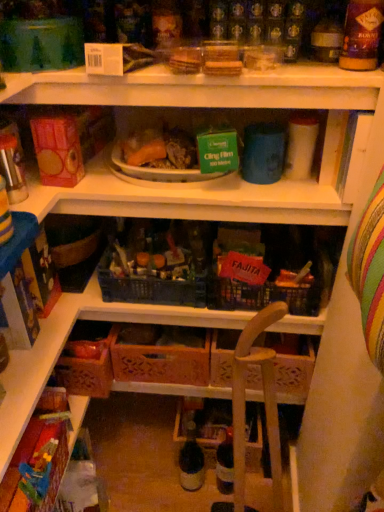
Question: Based on their sizes in the image, would you say wooden crate at center is bigger or smaller than multicolored fabric toy at lower left?

Choices:
 (A) small
 (B) big

Answer: (B)

Question: From their relative heights in the image, would you say wooden crate at center is taller or shorter than multicolored fabric toy at lower left?

Choices:
 (A) tall
 (B) short

Answer: (A)

Question: Which object is positioned closest to the white plastic plate at upper center?

Choices:
 (A) translucent glass bottle at center
 (B) orange plastic bowl at center
 (C) wooden crate at center
 (D) multicolored fabric toy at lower left

Answer: (B)

Question: Which is farther from the wooden crate at center?

Choices:
 (A) white plastic plate at upper center
 (B) translucent glass bottle at center
 (C) multicolored fabric toy at lower left
 (D) orange plastic bowl at center

Answer: (D)